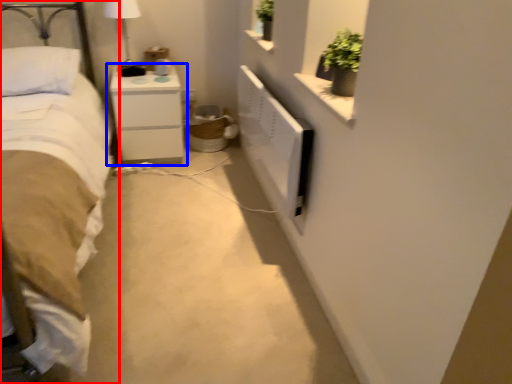
Question: Which object appears closest to the camera in this image, bed (highlighted by a red box) or nightstand (highlighted by a blue box)?

Choices:
 (A) bed
 (B) nightstand

Answer: (A)